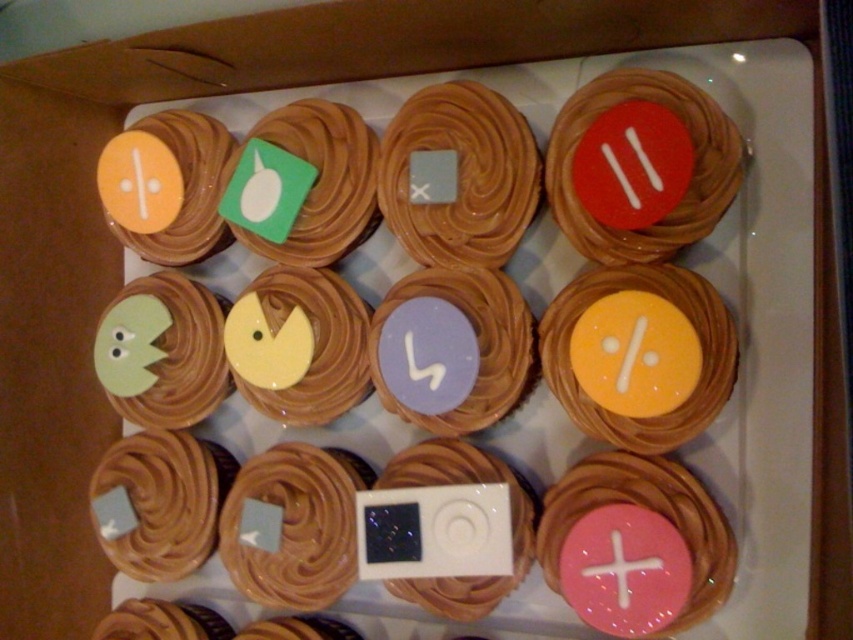
Does point (643, 563) come farther from viewer compared to point (412, 333)?

No, (643, 563) is closer to viewer.

Find the location of `pink glossy cross at center`. pink glossy cross at center is located at coordinates pyautogui.click(x=621, y=566).

Which is behind, point (676, 243) or point (622, 288)?

The point (622, 288) is behind.

Does red matte button at upper right come in front of matte yellow icing at center right?

No, red matte button at upper right is further to the viewer.

Which is in front, point (579, 243) or point (567, 330)?

Positioned in front is point (567, 330).

The width and height of the screenshot is (853, 640). Identify the location of red matte button at upper right. (691, 180).

Is matte white square at center above white glossy ipod at center?

Actually, matte white square at center is below white glossy ipod at center.

This screenshot has width=853, height=640. In order to click on matte white square at center in this screenshot , I will do point(294,528).